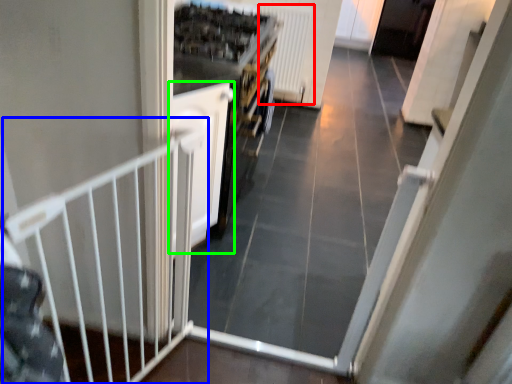
Question: Based on their relative distances, which object is nearer to radiator (highlighted by a red box)? Choose from rail (highlighted by a blue box) and door (highlighted by a green box).

Choices:
 (A) rail
 (B) door

Answer: (B)